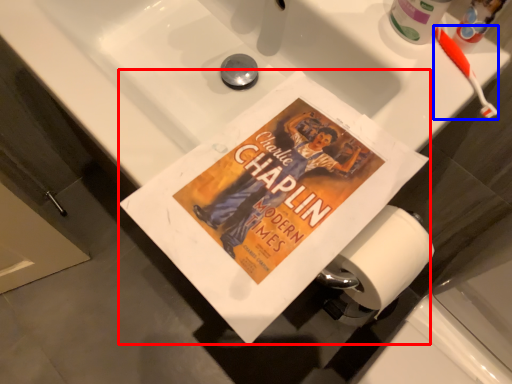
Question: Which object appears closest to the camera in this image, paperback book (highlighted by a red box) or toothbrush (highlighted by a blue box)?

Choices:
 (A) paperback book
 (B) toothbrush

Answer: (A)